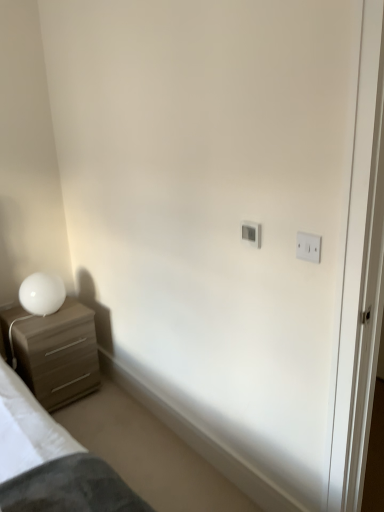
Question: Does white plastic light switch at upper center, acting as the 2th light switch starting from the right, have a greater height compared to matte wood chest of drawers at left?

Choices:
 (A) no
 (B) yes

Answer: (A)

Question: Is white plastic light switch at upper center, the 1th light switch viewed from the back, located outside matte wood chest of drawers at left?

Choices:
 (A) yes
 (B) no

Answer: (A)

Question: From a real-world perspective, does white plastic light switch at upper center, acting as the 2th light switch starting from the right, sit lower than matte wood chest of drawers at left?

Choices:
 (A) no
 (B) yes

Answer: (A)

Question: Can you confirm if white plastic light switch at upper center, acting as the 2th light switch starting from the right, is smaller than matte wood chest of drawers at left?

Choices:
 (A) yes
 (B) no

Answer: (A)

Question: Is white plastic light switch at upper center, marked as the first light switch in a left-to-right arrangement, at the left side of matte wood chest of drawers at left?

Choices:
 (A) yes
 (B) no

Answer: (B)

Question: Is white plastic light switch at upper center, marked as the first light switch in a left-to-right arrangement, looking in the opposite direction of matte wood chest of drawers at left?

Choices:
 (A) no
 (B) yes

Answer: (A)

Question: Is white plastic light switch at upper right, which is the 1th light switch from right to left, at the back of white plastic light switch at upper center, the 1th light switch viewed from the back?

Choices:
 (A) yes
 (B) no

Answer: (B)

Question: From a real-world perspective, is white plastic light switch at upper center, the 1th light switch viewed from the back, physically above white plastic light switch at upper right, which is the 1th light switch from right to left?

Choices:
 (A) yes
 (B) no

Answer: (B)

Question: Does white plastic light switch at upper center, the second light switch when ordered from front to back, have a greater width compared to white plastic light switch at upper right, positioned as the 2th light switch in back-to-front order?

Choices:
 (A) yes
 (B) no

Answer: (A)

Question: Considering the relative positions of white plastic light switch at upper center, acting as the 2th light switch starting from the right, and white plastic light switch at upper right, placed as the first light switch when sorted from front to back, in the image provided, is white plastic light switch at upper center, acting as the 2th light switch starting from the right, to the left of white plastic light switch at upper right, placed as the first light switch when sorted from front to back, from the viewer's perspective?

Choices:
 (A) yes
 (B) no

Answer: (A)

Question: Is white plastic light switch at upper center, the second light switch when ordered from front to back, smaller than white plastic light switch at upper right, which is the 1th light switch from right to left?

Choices:
 (A) yes
 (B) no

Answer: (B)

Question: From a real-world perspective, is white plastic light switch at upper center, acting as the 2th light switch starting from the right, physically below white plastic light switch at upper right, which is the 1th light switch from right to left?

Choices:
 (A) no
 (B) yes

Answer: (B)

Question: Can we say white plastic light switch at upper right, which is the second light switch in left-to-right order, lies outside matte wood chest of drawers at left?

Choices:
 (A) yes
 (B) no

Answer: (A)